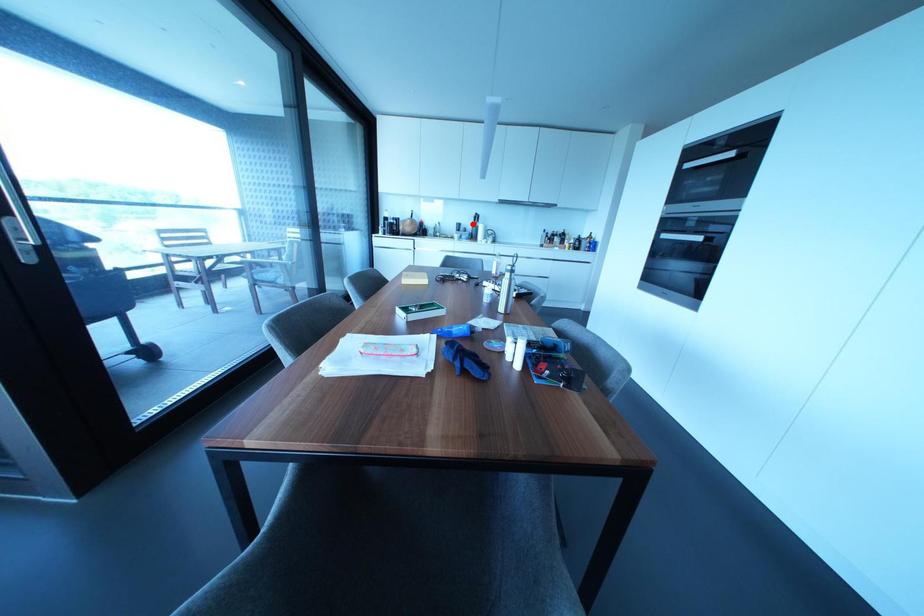
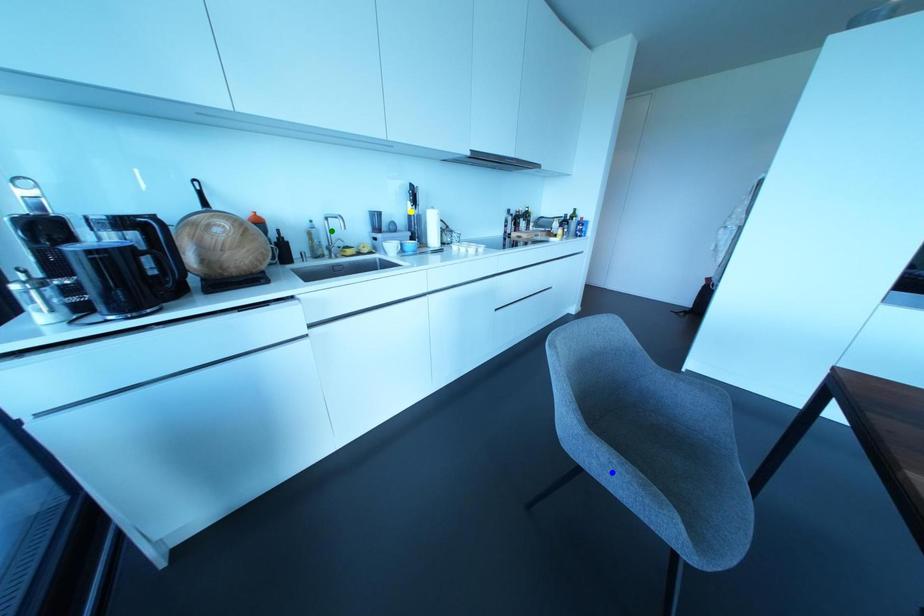
Question: I am providing you with two images of the same scene from different viewpoints. A red point is marked on the first image. You are given multiple points on the second image. Which point in image 2 represents the same 3d spot as the red point in image 1?

Choices:
 (A) yellow point
 (B) green point
 (C) blue point

Answer: (A)